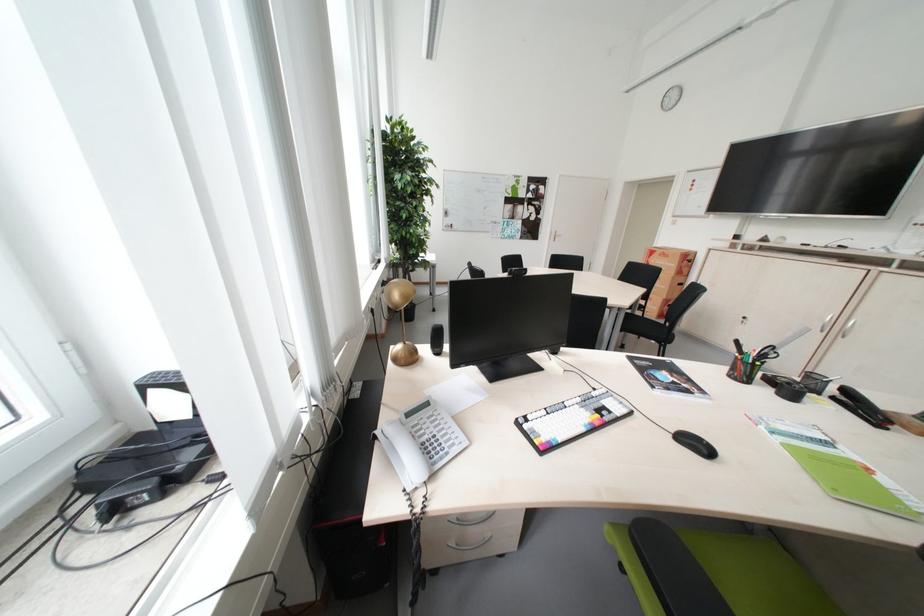
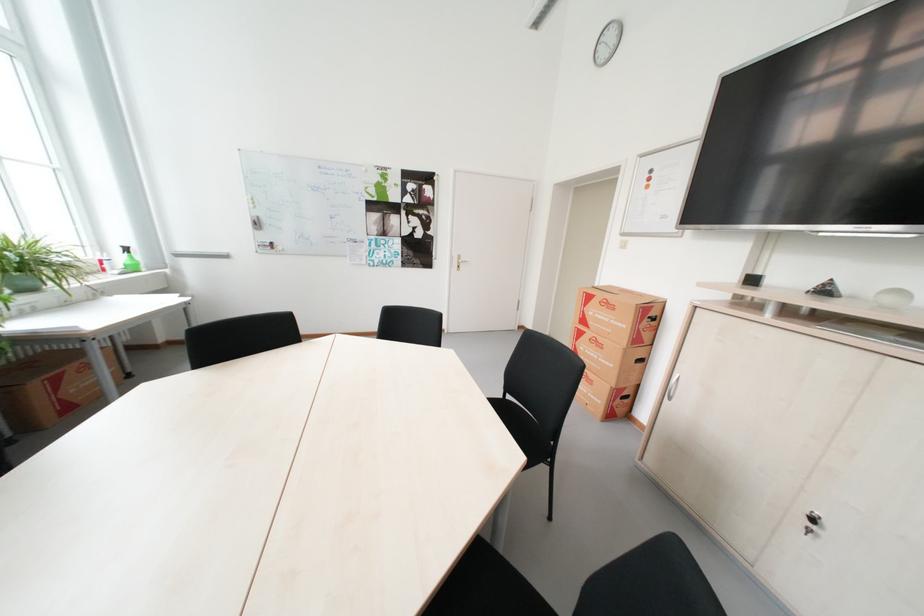
The point at (673, 308) is marked in the first image. Where is the corresponding point in the second image?

(622, 400)